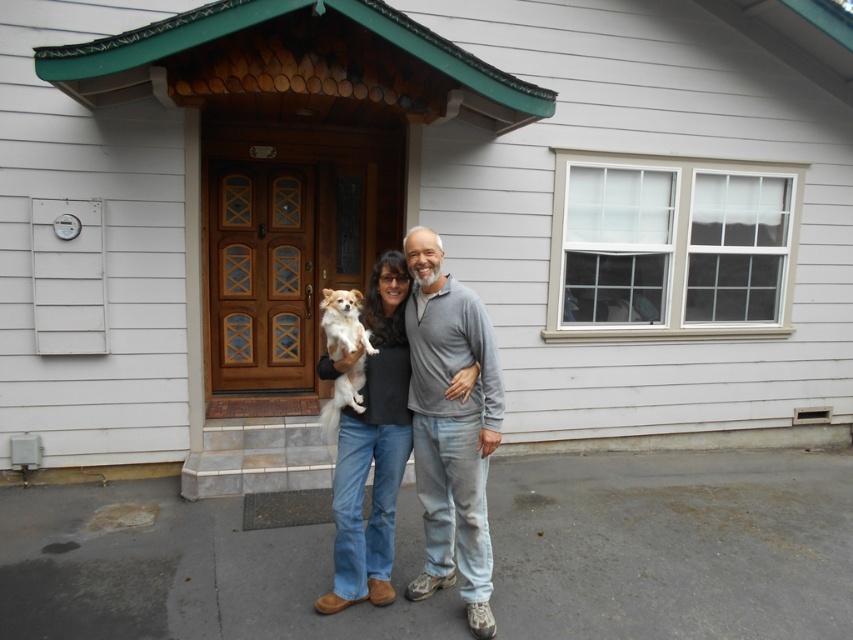
Question: Is gray cotton sweater at center smaller than matte black shirt at center?

Choices:
 (A) yes
 (B) no

Answer: (B)

Question: Estimate the real-world distances between objects in this image. Which object is closer to the gray cotton sweater at center?

Choices:
 (A) fluffy white dog at center
 (B) matte black shirt at center

Answer: (B)

Question: Among these objects, which one is nearest to the camera?

Choices:
 (A) fluffy white dog at center
 (B) gray cotton sweater at center

Answer: (B)

Question: Where is gray cotton sweater at center located in relation to matte black shirt at center in the image?

Choices:
 (A) above
 (B) below

Answer: (A)

Question: Is matte black shirt at center further to the viewer compared to fluffy white dog at center?

Choices:
 (A) no
 (B) yes

Answer: (B)

Question: Which point is closer to the camera?

Choices:
 (A) fluffy white dog at center
 (B) gray cotton sweater at center
 (C) matte black shirt at center

Answer: (B)